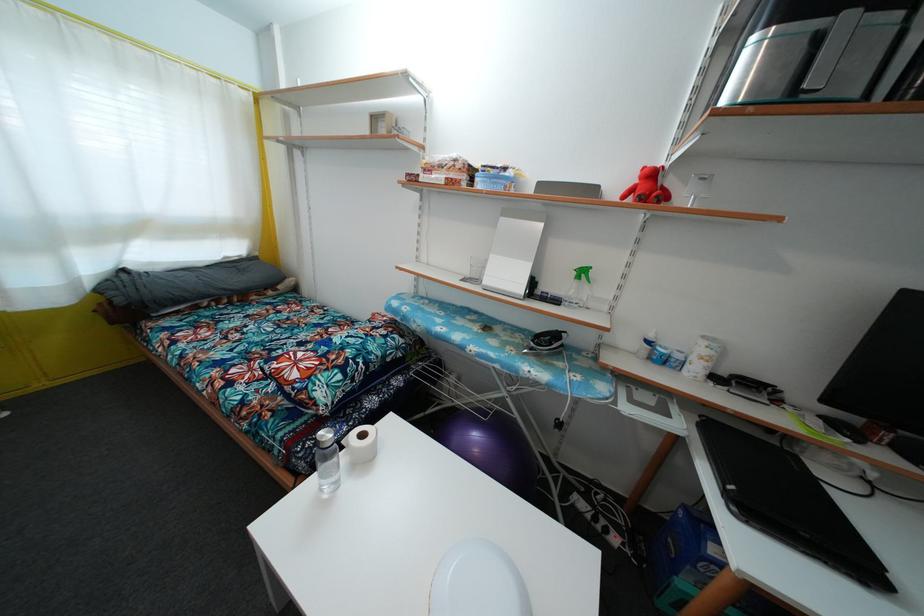
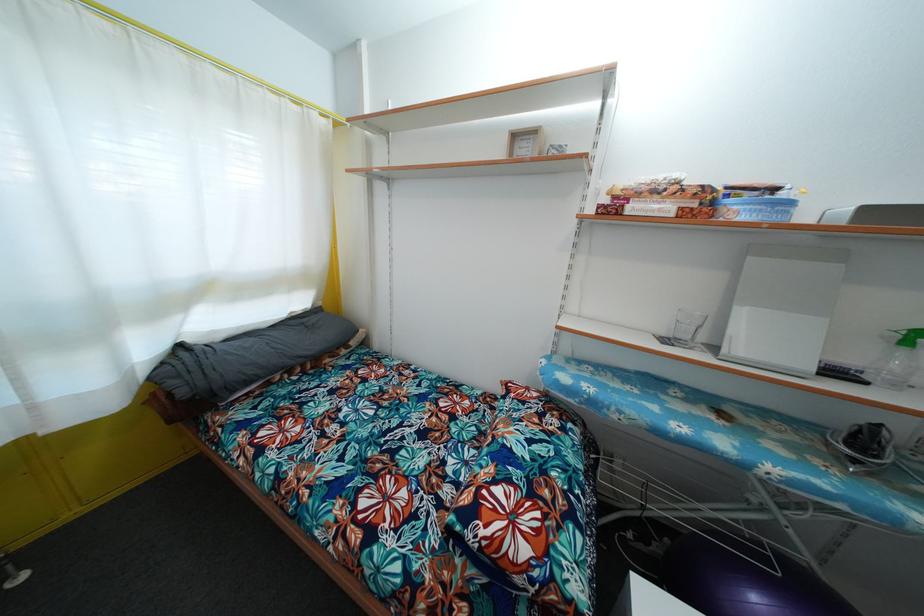
The point at (458, 167) is marked in the first image. Where is the corresponding point in the second image?

(683, 188)